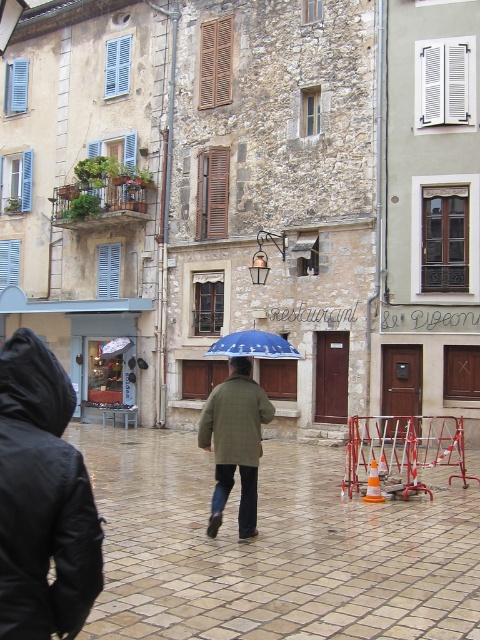
Does point (233, 416) lie in front of point (285, 342)?

That is True.

Can you confirm if green matte coat at center is bigger than blue fabric umbrella at center?

No, green matte coat at center is not bigger than blue fabric umbrella at center.

Describe the element at coordinates (235, 442) in the screenshot. I see `green matte coat at center` at that location.

Where is `green matte coat at center`? green matte coat at center is located at coordinates (235, 442).

Is brown stone pavement at center shorter than green matte coat at center?

Incorrect, brown stone pavement at center's height does not fall short of green matte coat at center's.

Is point (149, 577) positioned after point (250, 380)?

No, (149, 577) is closer to viewer.

Locate an element on the screen. This screenshot has height=640, width=480. brown stone pavement at center is located at coordinates (273, 548).

Measure the distance between brown stone pavement at center and blue fabric umbrella at center.

brown stone pavement at center and blue fabric umbrella at center are 11.12 feet apart from each other.

Between point (145, 536) and point (235, 332), which one is positioned in front?

Point (145, 536) is in front.

You are a GUI agent. You are given a task and a screenshot of the screen. Output one action in this format:
    pyautogui.click(x=<x>, y=<y>)
    Task: Click on the brown stone pavement at center
    
    Given the screenshot: What is the action you would take?
    pyautogui.click(x=273, y=548)

The image size is (480, 640). Identify the location of brown stone pavement at center. [273, 548].